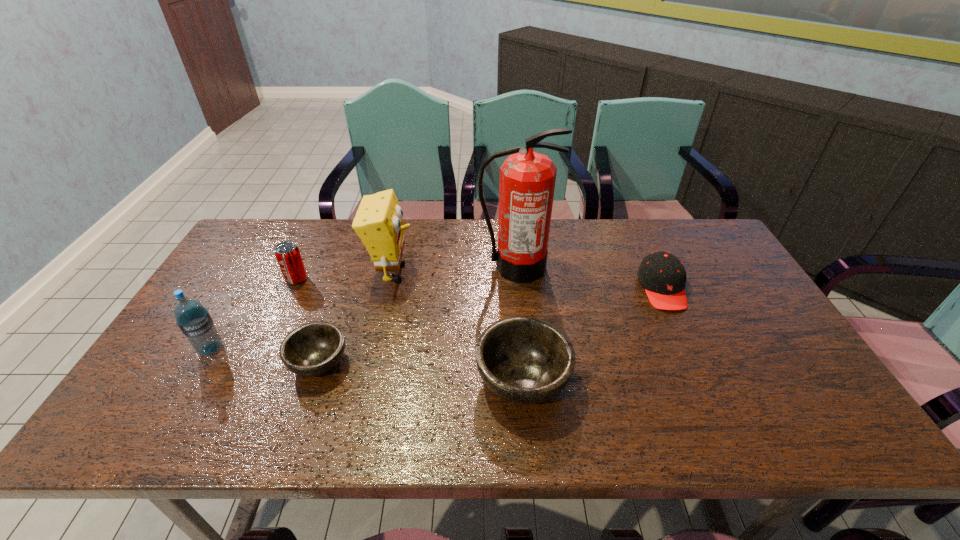
This screenshot has height=540, width=960. I want to click on vacant space situated 0.270m on the left of the shorter bowl, so click(180, 362).

Identify the location of vacant space located 0.180m on the left of the taller bowl. This screenshot has height=540, width=960. pyautogui.click(x=400, y=380).

You are a GUI agent. You are given a task and a screenshot of the screen. Output one action in this format:
    pyautogui.click(x=<x>, y=<y>)
    Task: Click on the free space located 0.240m on the back of the fourth tallest object
    The image size is (960, 540).
    Given the screenshot: What is the action you would take?
    [x=322, y=228]

You are a GUI agent. You are given a task and a screenshot of the screen. Output one action in this format:
    pyautogui.click(x=<x>, y=<y>)
    Task: Click on the free space located 0.170m on the face of the sixth shortest object
    This screenshot has height=540, width=960.
    Given the screenshot: What is the action you would take?
    pyautogui.click(x=471, y=272)

Where is `vacant position located on the front-facing side of the cap`? The height and width of the screenshot is (540, 960). vacant position located on the front-facing side of the cap is located at coordinates (682, 332).

Identify the location of free space located on the front side of the fire extinguisher. (527, 380).

The image size is (960, 540). Identify the location of vacant area situated 0.170m on the back of the water bottle. (243, 294).

Locate an element on the screen. sponge present at the far edge is located at coordinates (378, 222).

Identify the location of fire extinguisher present at the far edge. (527, 179).

Where is `object present at the left edge`? object present at the left edge is located at coordinates [x=193, y=319].